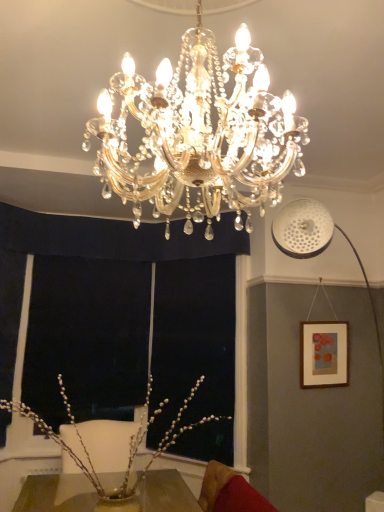
Question: Does wooden picture frame at right appear on the left side of velvet red swivel chair at lower right?

Choices:
 (A) yes
 (B) no

Answer: (B)

Question: Is wooden picture frame at right taller than velvet red swivel chair at lower right?

Choices:
 (A) yes
 (B) no

Answer: (A)

Question: From a real-world perspective, does wooden picture frame at right sit lower than velvet red swivel chair at lower right?

Choices:
 (A) no
 (B) yes

Answer: (A)

Question: Does wooden picture frame at right have a larger size compared to velvet red swivel chair at lower right?

Choices:
 (A) yes
 (B) no

Answer: (B)

Question: Could you tell me if wooden picture frame at right is turned towards velvet red swivel chair at lower right?

Choices:
 (A) no
 (B) yes

Answer: (A)

Question: Which is correct: pearl-like branches at center is inside wooden picture frame at right, or outside of it?

Choices:
 (A) outside
 (B) inside

Answer: (A)

Question: In the image, is pearl-like branches at center positioned in front of or behind wooden picture frame at right?

Choices:
 (A) front
 (B) behind

Answer: (A)

Question: Does point (147, 400) appear closer or farther from the camera than point (329, 365)?

Choices:
 (A) farther
 (B) closer

Answer: (A)

Question: Is pearl-like branches at center bigger or smaller than wooden picture frame at right?

Choices:
 (A) big
 (B) small

Answer: (A)

Question: Considering the positions of velvet red swivel chair at lower right and pearl-like branches at center in the image, is velvet red swivel chair at lower right taller or shorter than pearl-like branches at center?

Choices:
 (A) short
 (B) tall

Answer: (A)

Question: Looking at their shapes, would you say velvet red swivel chair at lower right is wider or thinner than pearl-like branches at center?

Choices:
 (A) thin
 (B) wide

Answer: (A)

Question: Is velvet red swivel chair at lower right bigger or smaller than pearl-like branches at center?

Choices:
 (A) small
 (B) big

Answer: (A)

Question: Is point (266, 510) positioned closer to the camera than point (135, 487)?

Choices:
 (A) farther
 (B) closer

Answer: (A)

Question: Is pearl-like branches at center spatially inside gold crystal chandelier at center, or outside of it?

Choices:
 (A) inside
 (B) outside

Answer: (B)

Question: Considering the positions of point (198, 382) and point (178, 96), is point (198, 382) closer or farther from the camera than point (178, 96)?

Choices:
 (A) farther
 (B) closer

Answer: (A)